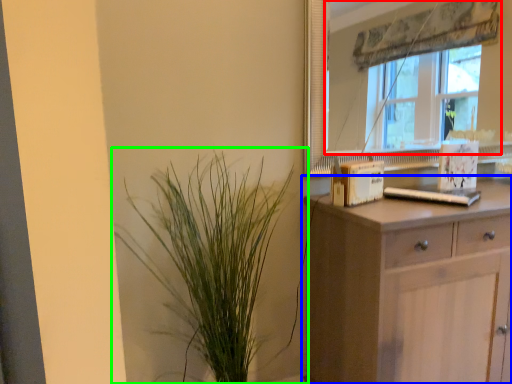
Question: Which object is the farthest from window (highlighted by a red box)? Choose among these: chest of drawers (highlighted by a blue box) or houseplant (highlighted by a green box).

Choices:
 (A) chest of drawers
 (B) houseplant

Answer: (B)